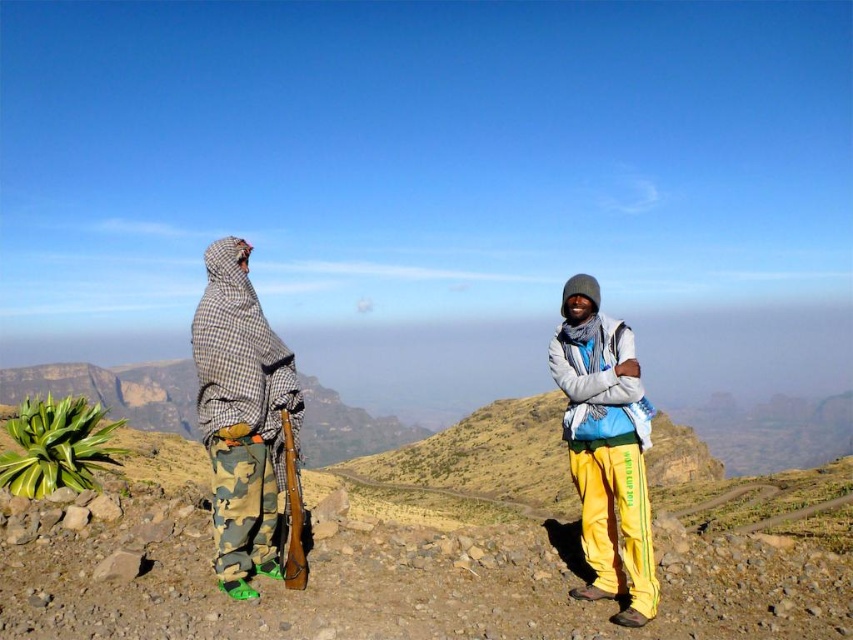
Based on the coordinates provided, can you identify which object corresponds to the point at (x=606, y=449)?

The point at (x=606, y=449) corresponds to the camouflage pants at left.

Consider the image. You are a photographer trying to capture a group photo of two people standing on a rocky mountain terrain. You notice the camouflage pants at left and the yellow fleece pants at right in the frame. Which person should you ask to move to the right to center them between the two rocky areas on either side?

The camouflage pants at left should move to the right to center them between the two rocky areas since they are currently positioned on the left side of the yellow fleece pants at right.

From the picture: You are a photographer trying to capture both the camouflage pants at left and the yellow fleece pants at right in the same frame. Considering their sizes, which one should you focus on to ensure both are clearly visible?

To ensure both the camouflage pants at left and the yellow fleece pants at right are clearly visible, focus on the camouflage pants at left since it is larger and will be easier to frame alongside the smaller yellow fleece pants at right.